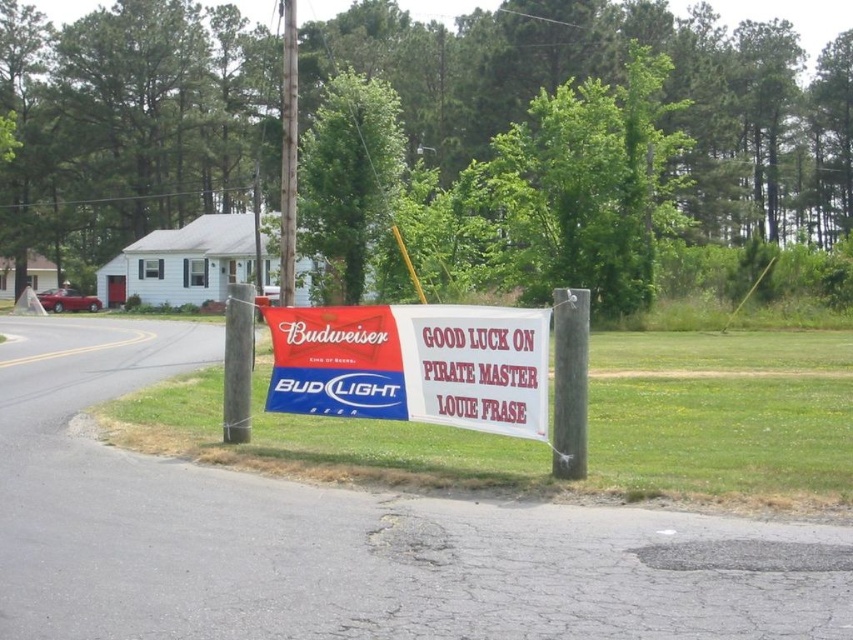
You are a delivery person trying to deliver a package to the address of the small white house with a gray roof. You see a matte plastic banner at center and a metallic pole at center in your path. Can you pass through the space between them without needing to move either object?

The matte plastic banner at center and metallic pole at center are 22.01 meters apart, so yes, you can pass through the space between them without needing to move either object since the distance is more than sufficient for passage.

You are a delivery person trying to navigate a narrow path between the smooth gray pole at center and the metallic gray pole at center. Your delivery cart is 3 meters wide. Can you safely pass through the gap between them without hitting the poles?

The smooth gray pole at center and metallic gray pole at center are 3.86 meters apart from each other. Since your delivery cart is 3 meters wide, there is enough space to pass through the gap safely without hitting the poles.